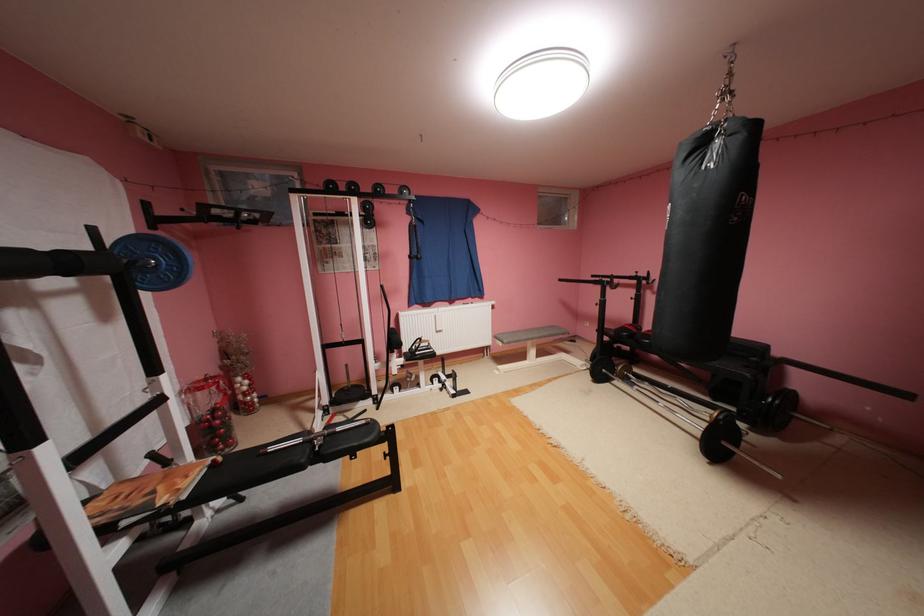
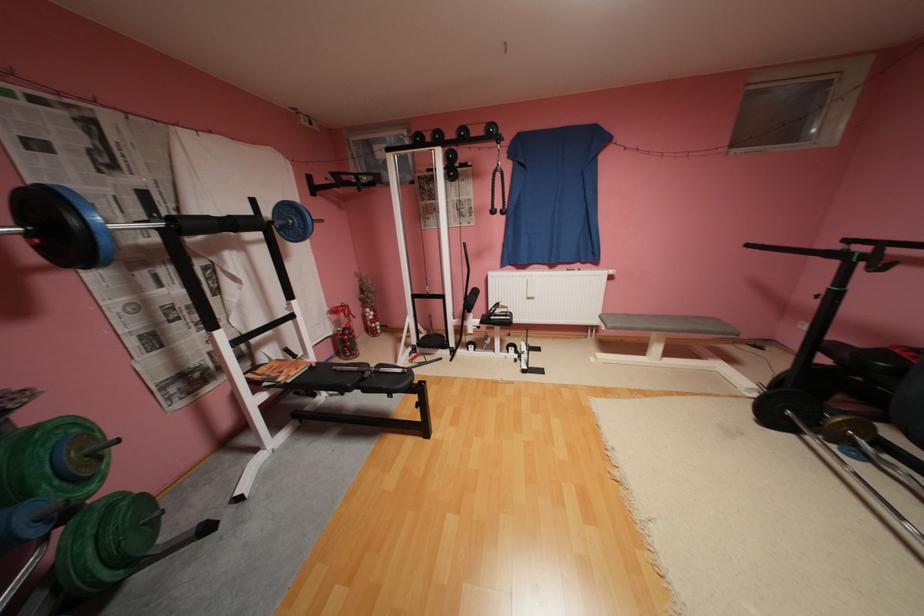
Find the pixel in the second image that matches the point at 192,496 in the first image.

(298, 381)